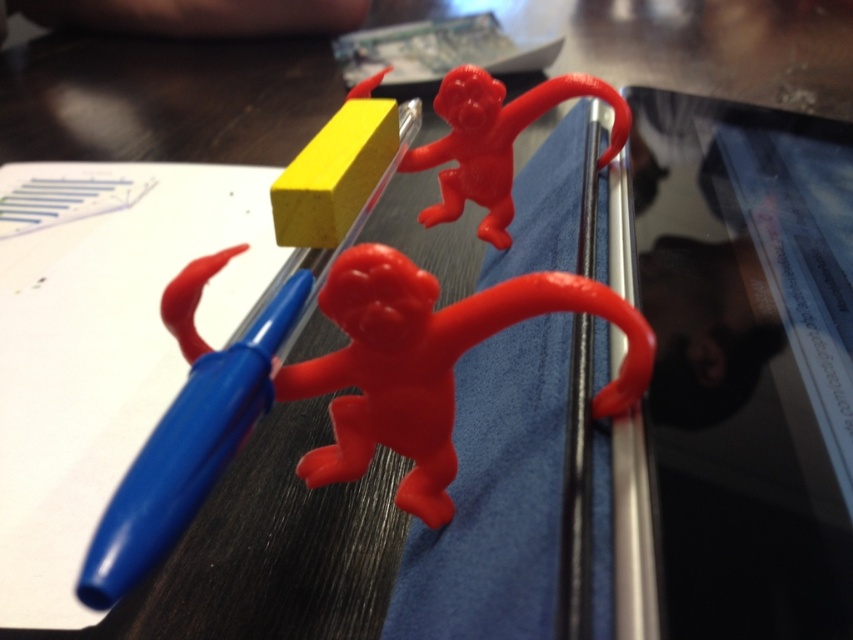
Measure the distance between blue plastic pencil at left and camera.

blue plastic pencil at left is 46.42 centimeters from camera.

Where is `blue plastic pencil at left`? The image size is (853, 640). blue plastic pencil at left is located at coordinates coord(241,344).

You are a GUI agent. You are given a task and a screenshot of the screen. Output one action in this format:
    pyautogui.click(x=<x>, y=<y>)
    Task: Click on the blue plastic pencil at left
    
    Given the screenshot: What is the action you would take?
    pyautogui.click(x=241, y=344)

Which is below, matte plastic monkey at center or matte plastic monkey at upper center?

Positioned lower is matte plastic monkey at center.

Is point (519, 314) closer to camera compared to point (497, 141)?

Yes, point (519, 314) is in front of point (497, 141).

Locate an element on the screen. The image size is (853, 640). matte plastic monkey at center is located at coordinates (430, 364).

Can you confirm if blue plastic pencil at left is positioned to the right of matte plastic monkey at upper center?

No, blue plastic pencil at left is not to the right of matte plastic monkey at upper center.

Who is more distant from viewer, (312, 205) or (618, 120)?

Point (618, 120)

Where is `blue plastic pencil at left`? blue plastic pencil at left is located at coordinates (241, 344).